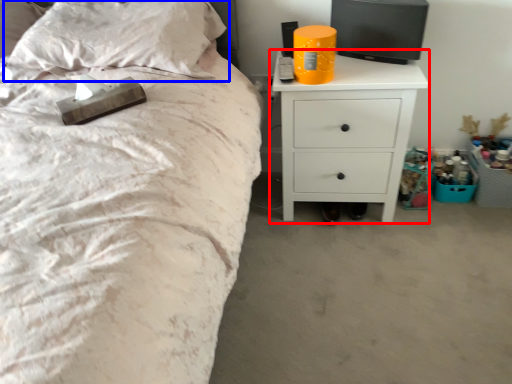
Question: Which point is closer to the camera, nightstand (highlighted by a red box) or pillow (highlighted by a blue box)?

Choices:
 (A) nightstand
 (B) pillow

Answer: (B)